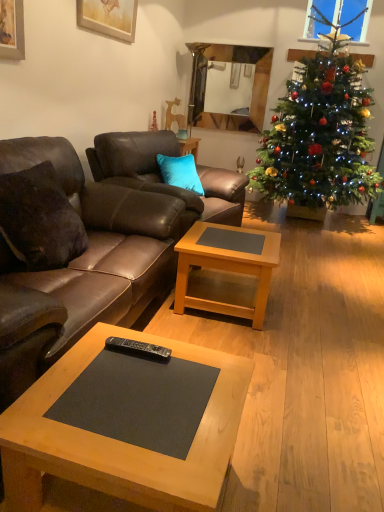
In order to click on vacant space in front of light brown wooden coffee table at center, which is the 2th coffee table from front to back in this screenshot , I will do `click(276, 355)`.